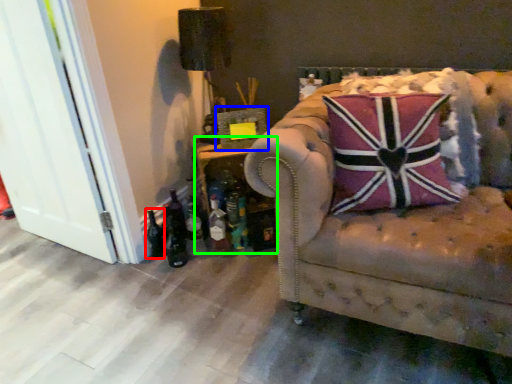
Question: Considering the real-world distances, which object is farthest from bottle (highlighted by a red box)? picture frame (highlighted by a blue box) or table (highlighted by a green box)?

Choices:
 (A) picture frame
 (B) table

Answer: (A)